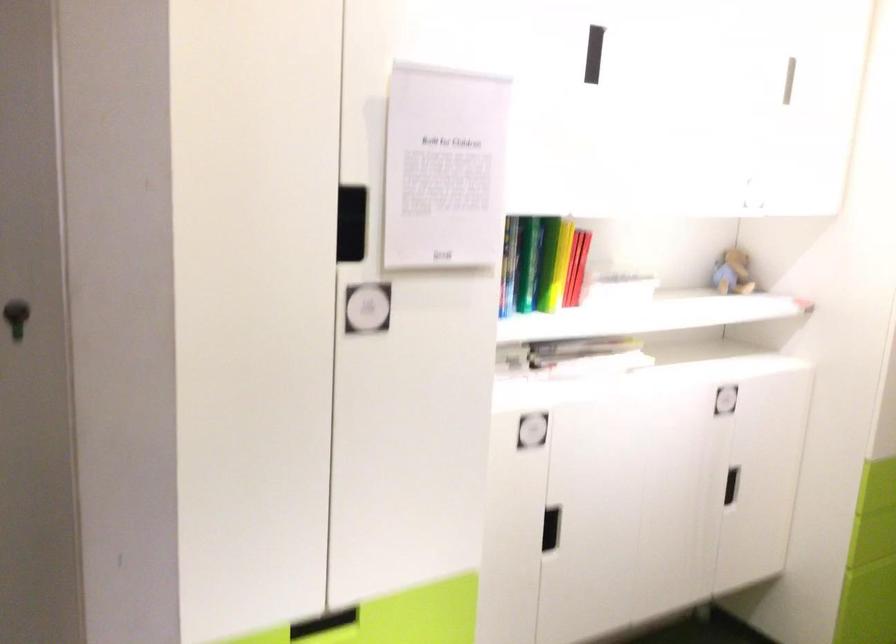
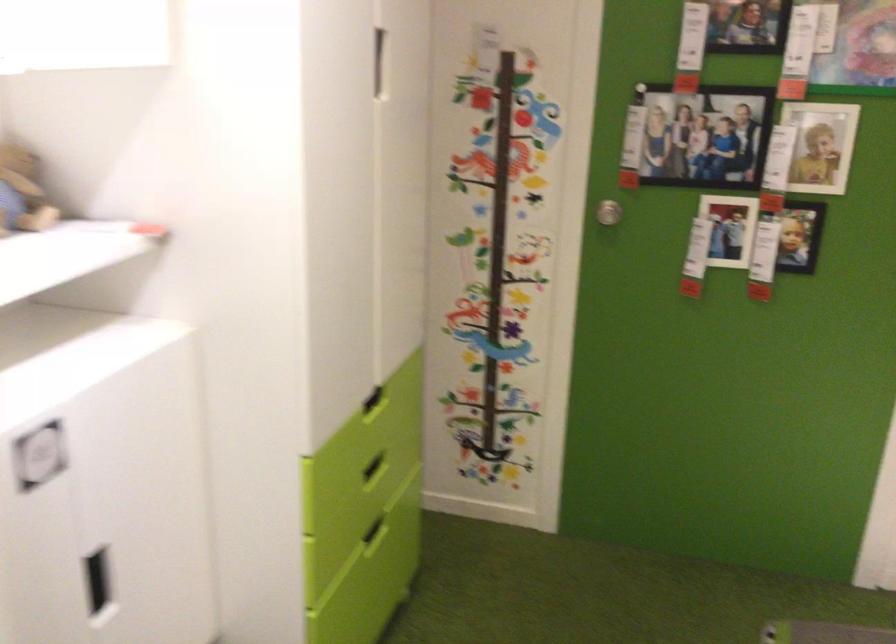
Question: The images are taken continuously from a first-person perspective. In which direction is your viewpoint rotating?

Choices:
 (A) Left
 (B) Right
 (C) Up
 (D) Down

Answer: (B)